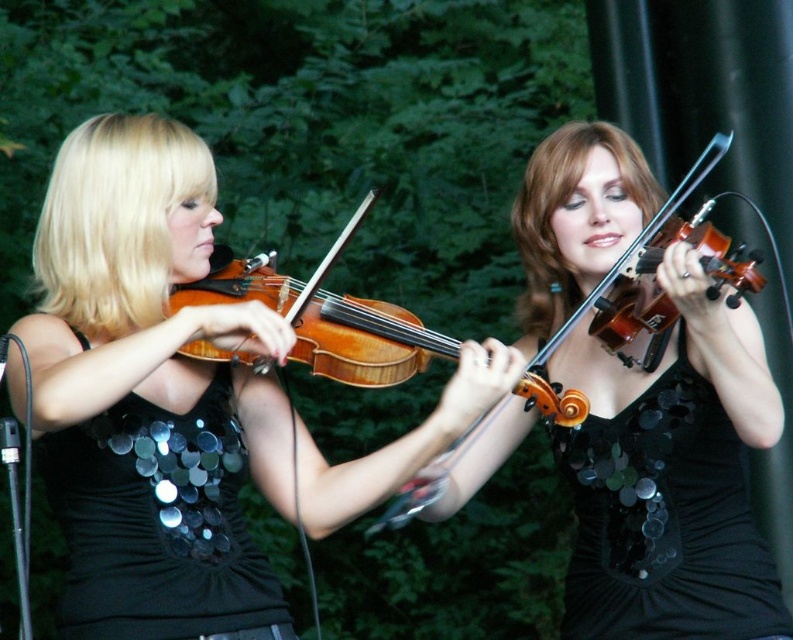
Question: Does wooden violin at center have a smaller size compared to shiny black violin at upper right?

Choices:
 (A) yes
 (B) no

Answer: (B)

Question: Does black sequined dress at left appear under wooden violin at center?

Choices:
 (A) no
 (B) yes

Answer: (B)

Question: Which point appears farthest from the camera in this image?

Choices:
 (A) (734, 480)
 (B) (240, 552)
 (C) (581, 419)

Answer: (A)

Question: Which of the following is the farthest from the observer?

Choices:
 (A) (788, 620)
 (B) (198, 228)
 (C) (523, 308)
 (D) (202, 605)

Answer: (C)

Question: Which point is farther to the camera?

Choices:
 (A) (110, 305)
 (B) (573, 177)
 (C) (182, 547)

Answer: (B)

Question: In this image, where is black sequined dress at center located relative to shiny black violin at upper right?

Choices:
 (A) above
 (B) below

Answer: (B)